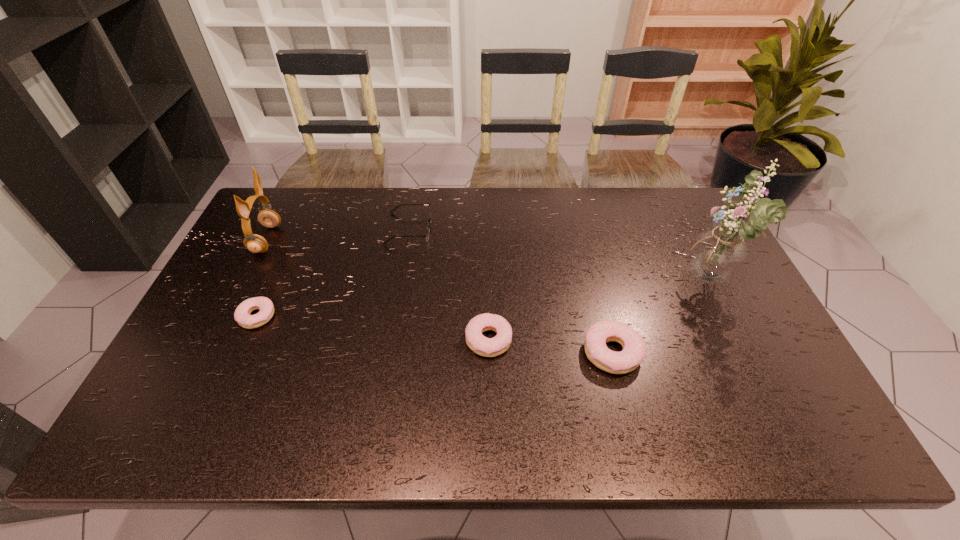
Identify the location of free area in between the third object from left to right and the second tallest object. (338, 234).

Locate an element on the screen. free area in between the earphone and the tallest object is located at coordinates (488, 261).

Image resolution: width=960 pixels, height=540 pixels. In order to click on object that can be found as the fifth closest to the tallest object in this screenshot , I will do `click(254, 243)`.

This screenshot has height=540, width=960. Find the location of `object that is the third closest to the second tallest object`. object that is the third closest to the second tallest object is located at coordinates (488, 347).

Select which doughnut appears as the second closest to the second shortest doughnut. Please provide its 2D coordinates. Your answer should be formatted as a tuple, i.e. [(x, y)], where the tuple contains the x and y coordinates of a point satisfying the conditions above.

[(242, 315)]

Image resolution: width=960 pixels, height=540 pixels. I want to click on doughnut that stands as the closest to the fourth object from left to right, so click(x=634, y=348).

I want to click on free point that satisfies the following two spatial constraints: 1. on the front side of the tallest doughnut; 2. on the right side of the leftmost doughnut, so click(241, 353).

At what (x,y) coordinates should I click in order to perform the action: click on free space that satisfies the following two spatial constraints: 1. on the front-facing side of the fourth object from right to left; 2. on the right side of the fourth object from left to right. Please return your answer as a coordinate pair (x, y). This screenshot has height=540, width=960. Looking at the image, I should click on (390, 340).

I want to click on vacant position in the image that satisfies the following two spatial constraints: 1. on the front-facing side of the rightmost doughnut; 2. on the right side of the fifth shortest object, so click(209, 353).

At what (x,y) coordinates should I click in order to perform the action: click on free space that satisfies the following two spatial constraints: 1. on the front-facing side of the third object from left to right; 2. on the back side of the third tallest object. Please return your answer as a coordinate pair (x, y). Looking at the image, I should click on (388, 353).